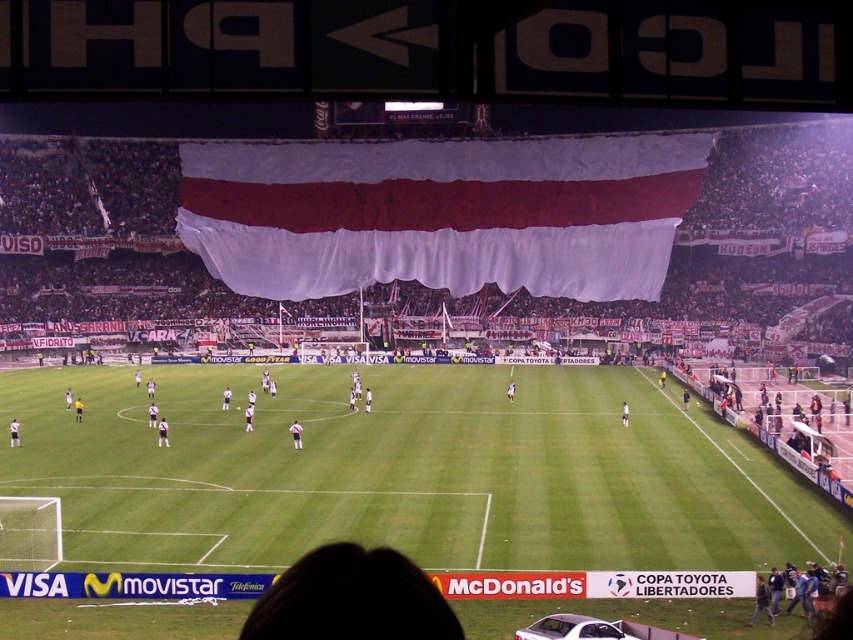
Question: Does green grass football field at center have a lesser width compared to white fabric banner at center?

Choices:
 (A) no
 (B) yes

Answer: (B)

Question: Considering the relative positions of green grass football field at center and white fabric banner at center in the image provided, where is green grass football field at center located with respect to white fabric banner at center?

Choices:
 (A) above
 (B) below

Answer: (B)

Question: Does green grass football field at center come behind white fabric banner at center?

Choices:
 (A) no
 (B) yes

Answer: (A)

Question: Which point is farther from the camera taking this photo?

Choices:
 (A) (316, 177)
 (B) (531, 394)

Answer: (A)